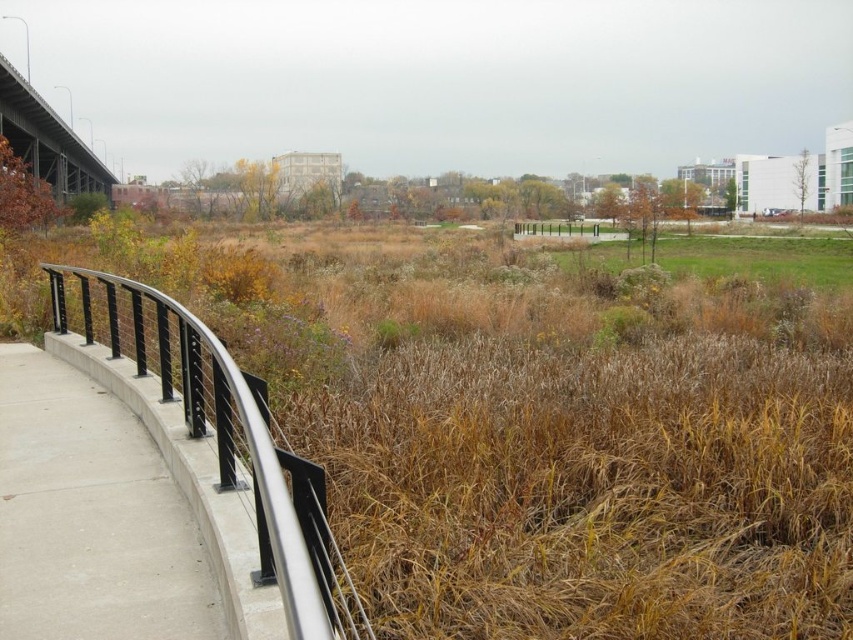
Question: Which point appears farthest from the camera in this image?

Choices:
 (A) (247, 484)
 (B) (79, 448)

Answer: (B)

Question: Estimate the real-world distances between objects in this image. Which object is farther from the concrete bridge at upper left?

Choices:
 (A) green grass at center
 (B) brown dry grass at center
 (C) concrete at left
 (D) black metal railing at left

Answer: (D)

Question: Does concrete at left appear over green grass at center?

Choices:
 (A) no
 (B) yes

Answer: (A)

Question: Is concrete at left bigger than black metal railing at left?

Choices:
 (A) yes
 (B) no

Answer: (A)

Question: Can you confirm if concrete at left is bigger than green grass at center?

Choices:
 (A) yes
 (B) no

Answer: (B)

Question: Which object is the farthest from the concrete at left?

Choices:
 (A) concrete bridge at upper left
 (B) brown dry grass at center
 (C) black metal railing at left

Answer: (A)